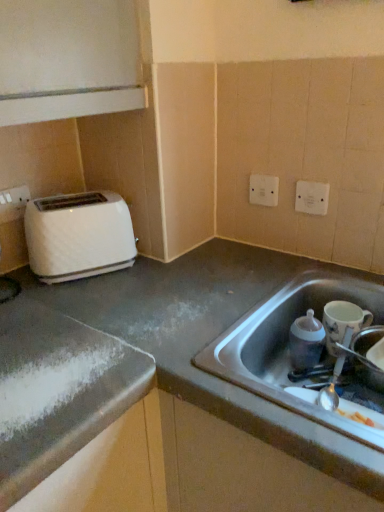
Locate an element on the screen. vacant point above smooth gray countertop at lower right (from a real-world perspective) is located at coordinates (192, 292).